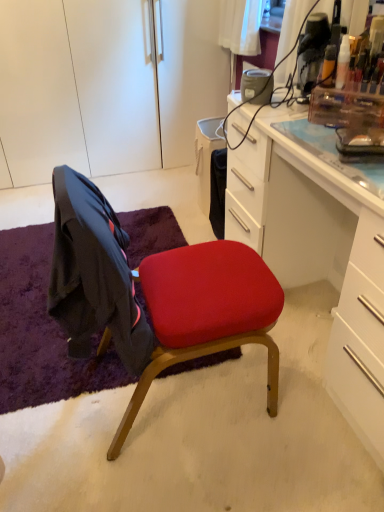
Question: From the image's perspective, is purple shaggy rug at lower left on matte red cushioned chair at center?

Choices:
 (A) no
 (B) yes

Answer: (A)

Question: Does purple shaggy rug at lower left have a greater height compared to matte red cushioned chair at center?

Choices:
 (A) no
 (B) yes

Answer: (A)

Question: Is purple shaggy rug at lower left wider than matte red cushioned chair at center?

Choices:
 (A) yes
 (B) no

Answer: (A)

Question: Is purple shaggy rug at lower left bigger than matte red cushioned chair at center?

Choices:
 (A) no
 (B) yes

Answer: (A)

Question: Considering the relative sizes of purple shaggy rug at lower left and matte red cushioned chair at center in the image provided, is purple shaggy rug at lower left thinner than matte red cushioned chair at center?

Choices:
 (A) yes
 (B) no

Answer: (B)

Question: From the image's perspective, is white matte cabinet at upper left positioned above or below white glossy desk at center?

Choices:
 (A) above
 (B) below

Answer: (A)

Question: In terms of size, does white matte cabinet at upper left appear bigger or smaller than white glossy desk at center?

Choices:
 (A) small
 (B) big

Answer: (B)

Question: In terms of width, does white matte cabinet at upper left look wider or thinner when compared to white glossy desk at center?

Choices:
 (A) thin
 (B) wide

Answer: (B)

Question: Considering their positions, is white matte cabinet at upper left located in front of or behind white glossy desk at center?

Choices:
 (A) front
 (B) behind

Answer: (B)

Question: Is point (375, 316) positioned closer to the camera than point (193, 263)?

Choices:
 (A) farther
 (B) closer

Answer: (B)

Question: Considering the positions of white glossy desk at center and matte red cushioned chair at center in the image, is white glossy desk at center bigger or smaller than matte red cushioned chair at center?

Choices:
 (A) big
 (B) small

Answer: (A)

Question: Considering their positions, is white glossy desk at center located in front of or behind matte red cushioned chair at center?

Choices:
 (A) behind
 (B) front

Answer: (B)

Question: From the image's perspective, relative to matte red cushioned chair at center, is white glossy desk at center above or below?

Choices:
 (A) below
 (B) above

Answer: (B)

Question: In the image, is matte red cushioned chair at center on the left side or the right side of purple shaggy rug at lower left?

Choices:
 (A) left
 (B) right

Answer: (B)

Question: From the image's perspective, is matte red cushioned chair at center above or below purple shaggy rug at lower left?

Choices:
 (A) below
 (B) above

Answer: (B)